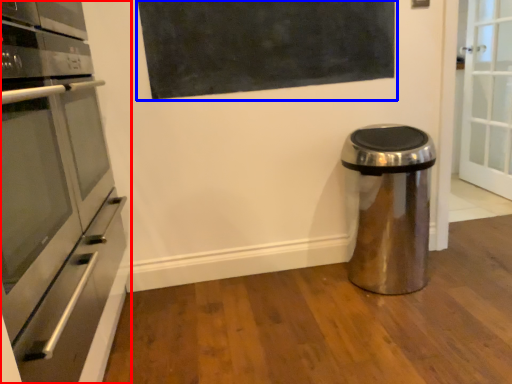
Question: Which of the following is the closest to the observer, home appliance (highlighted by a red box) or bulletin board (highlighted by a blue box)?

Choices:
 (A) home appliance
 (B) bulletin board

Answer: (A)